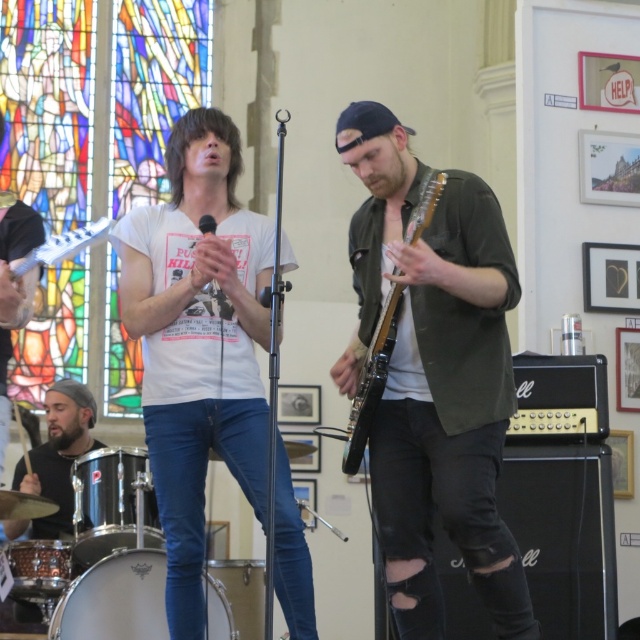
Can you confirm if white cotton t-shirt at center is thinner than black drum at lower left?

Incorrect, white cotton t-shirt at center's width is not less than black drum at lower left's.

From the picture: Is the position of white cotton t-shirt at center more distant than that of black drum at lower left?

That is False.

Between point (186, 310) and point (140, 481), which one is positioned in front?

Point (186, 310) is more forward.

You are a GUI agent. You are given a task and a screenshot of the screen. Output one action in this format:
    pyautogui.click(x=<x>, y=<y>)
    Task: Click on the white cotton t-shirt at center
    
    Given the screenshot: What is the action you would take?
    pyautogui.click(x=196, y=342)

Which is more to the right, stained glass window at upper left or wooden electric guitar at center?

wooden electric guitar at center is more to the right.

Who is positioned more to the left, stained glass window at upper left or wooden electric guitar at center?

From the viewer's perspective, stained glass window at upper left appears more on the left side.

Which is in front, point (84, 220) or point (372, 378)?

Positioned in front is point (372, 378).

The width and height of the screenshot is (640, 640). What are the coordinates of `stained glass window at upper left` in the screenshot? It's located at (93, 97).

Is silver metallic drum at lower left smaller than wooden electric guitar at center?

Correct, silver metallic drum at lower left occupies less space than wooden electric guitar at center.

Is point (227, 625) more distant than point (365, 440)?

Yes, it is behind point (365, 440).

The image size is (640, 640). What do you see at coordinates (115, 600) in the screenshot?
I see `silver metallic drum at lower left` at bounding box center [115, 600].

You are a GUI agent. You are given a task and a screenshot of the screen. Output one action in this format:
    pyautogui.click(x=<x>, y=<y>)
    Task: Click on the silver metallic drum at lower left
    
    Given the screenshot: What is the action you would take?
    pyautogui.click(x=115, y=600)